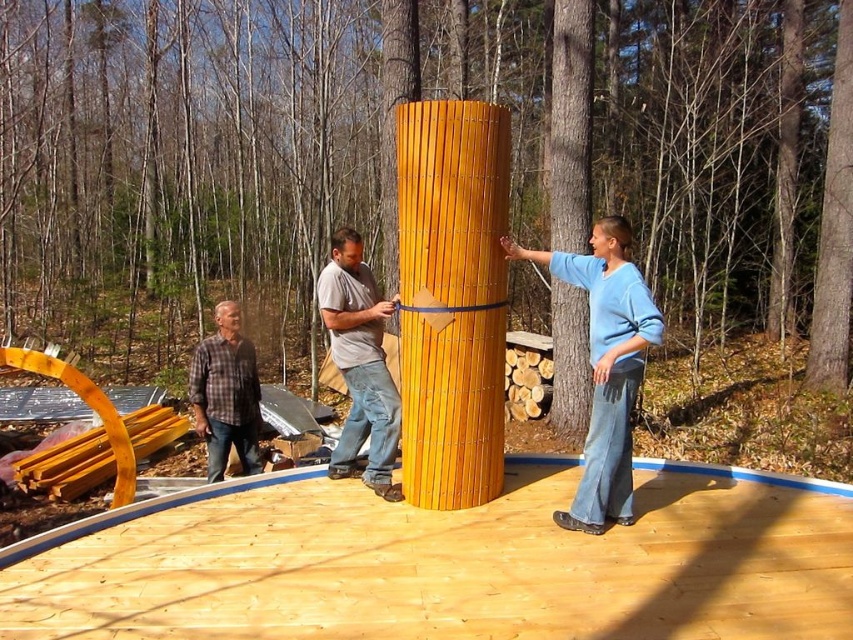
Question: Does blue cotton sweater at center have a lesser width compared to plaid fabric shirt at lower left?

Choices:
 (A) yes
 (B) no

Answer: (B)

Question: Does smooth bamboo pillar at center appear over matte gray shirt at center?

Choices:
 (A) yes
 (B) no

Answer: (A)

Question: Does matte gray shirt at center have a larger size compared to plaid fabric shirt at lower left?

Choices:
 (A) no
 (B) yes

Answer: (B)

Question: Which object is farther from the camera taking this photo?

Choices:
 (A) blue cotton sweater at center
 (B) plaid fabric shirt at lower left
 (C) matte gray shirt at center
 (D) smooth bamboo pillar at center

Answer: (B)

Question: Which object is the farthest from the matte gray shirt at center?

Choices:
 (A) smooth bamboo pillar at center
 (B) blue cotton sweater at center

Answer: (B)

Question: Which object appears farthest from the camera in this image?

Choices:
 (A) smooth bamboo pillar at center
 (B) blue cotton sweater at center
 (C) matte gray shirt at center

Answer: (C)